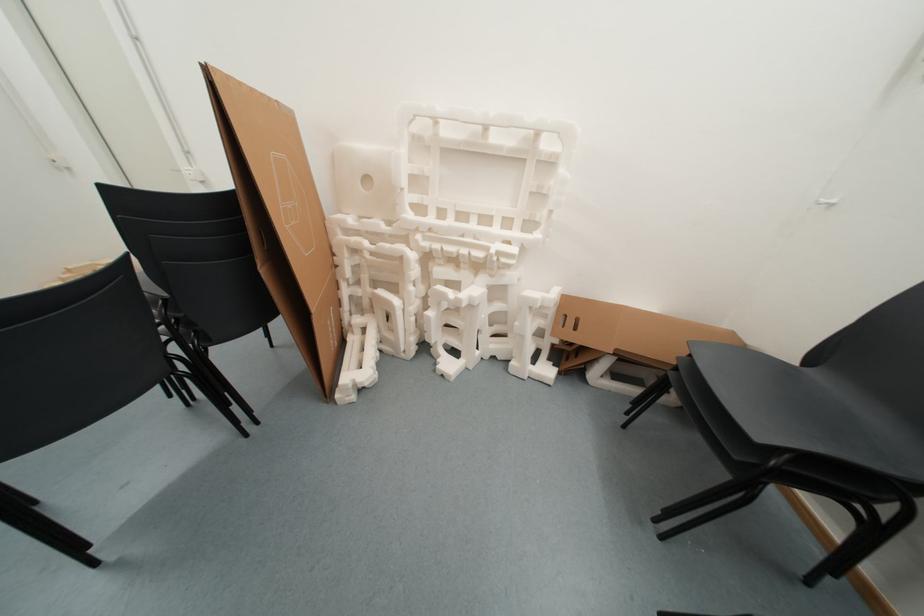
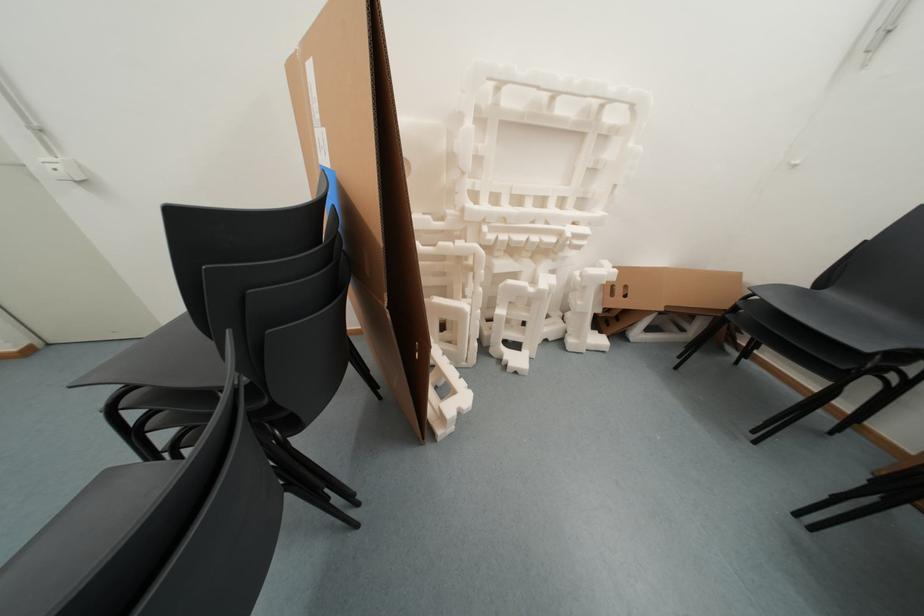
Question: Which direction would the cameraman need to move to produce the second image? Reply with the corresponding letter.

Choices:
 (A) Left
 (B) Right
 (C) Forward
 (D) Backward

Answer: (A)